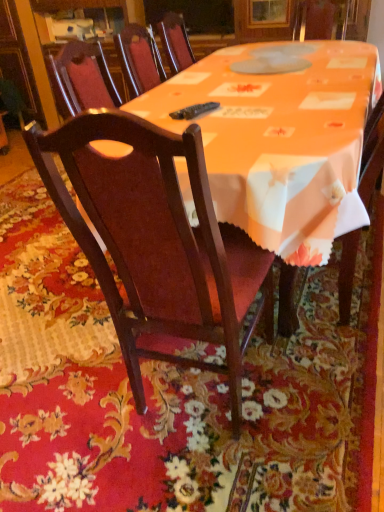
You are a GUI agent. You are given a task and a screenshot of the screen. Output one action in this format:
    pyautogui.click(x=<x>, y=<y>)
    Task: Click on the vacant space to the left of mahogany wood chair at center
    This screenshot has height=512, width=384.
    Given the screenshot: What is the action you would take?
    pyautogui.click(x=69, y=395)